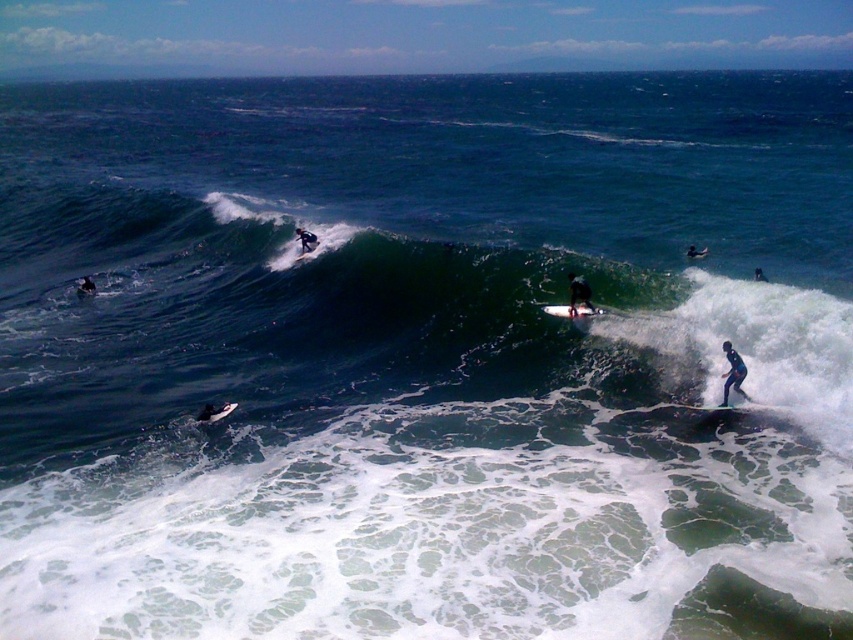
Question: Among these points, which one is nearest to the camera?

Choices:
 (A) (730, 356)
 (B) (581, 310)
 (C) (311, 241)
 (D) (579, 292)

Answer: (A)

Question: Is white foam surfboard at center above dark blue wetsuit at right?

Choices:
 (A) no
 (B) yes

Answer: (A)

Question: Which of the following is the farthest from the observer?

Choices:
 (A) white foam surfboard at center
 (B) black matte surfboard at right
 (C) dark blue wetsuit at right
 (D) black matte surfboard at center

Answer: (B)

Question: Is black matte wetsuit at lower right bigger than dark blue wetsuit at right?

Choices:
 (A) no
 (B) yes

Answer: (B)

Question: Among these points, which one is farthest from the camera?

Choices:
 (A) (759, 280)
 (B) (732, 364)

Answer: (A)

Question: Considering the relative positions of black matte wetsuit at lower right and white foam surfboard at center in the image provided, where is black matte wetsuit at lower right located with respect to white foam surfboard at center?

Choices:
 (A) above
 (B) below

Answer: (B)